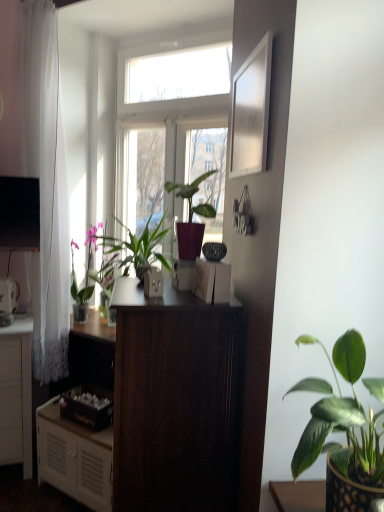
Question: Which direction should I rotate to face green matte plant at center, acting as the second houseplant starting from the right, — up or down?

Choices:
 (A) up
 (B) down

Answer: (A)

Question: Could metallic silver toaster at left, acting as the fifth appliance starting from the right, be considered to be inside wooden crate at lower left, marked as the 2th appliance in a back-to-front arrangement?

Choices:
 (A) no
 (B) yes

Answer: (A)

Question: Can you confirm if wooden crate at lower left, the fourth appliance positioned from the front, is positioned to the right of metallic silver toaster at left, acting as the fifth appliance starting from the right?

Choices:
 (A) yes
 (B) no

Answer: (A)

Question: Is wooden crate at lower left, the fourth appliance positioned from the front, not near metallic silver toaster at left, positioned as the 2th appliance in bottom-to-top order?

Choices:
 (A) yes
 (B) no

Answer: (B)

Question: Does wooden crate at lower left, which appears as the 2th appliance when viewed from the left, have a greater height compared to metallic silver toaster at left, acting as the fifth appliance starting from the right?

Choices:
 (A) yes
 (B) no

Answer: (B)

Question: Are wooden crate at lower left, marked as the fourth appliance in a right-to-left arrangement, and metallic silver toaster at left, which appears as the 4th appliance when viewed from the top, making contact?

Choices:
 (A) no
 (B) yes

Answer: (A)

Question: Is wooden crate at lower left, acting as the 1th appliance starting from the bottom, wider than metallic silver toaster at left, acting as the fifth appliance starting from the right?

Choices:
 (A) yes
 (B) no

Answer: (A)

Question: Does green glossy plant at left, placed as the 3th houseplant when sorted from front to back, come in front of white glossy picture frame at upper right?

Choices:
 (A) yes
 (B) no

Answer: (B)

Question: From the image's perspective, is green glossy plant at left, marked as the 3th houseplant in a right-to-left arrangement, located above white glossy picture frame at upper right?

Choices:
 (A) yes
 (B) no

Answer: (B)

Question: Is green glossy plant at left, placed as the 3th houseplant when sorted from front to back, outside white glossy picture frame at upper right?

Choices:
 (A) yes
 (B) no

Answer: (A)

Question: Does green glossy plant at left, placed as the 3th houseplant when sorted from front to back, have a smaller size compared to white glossy picture frame at upper right?

Choices:
 (A) no
 (B) yes

Answer: (A)

Question: From the image's perspective, would you say green glossy plant at left, placed as the 3th houseplant when sorted from front to back, is shown under white glossy picture frame at upper right?

Choices:
 (A) yes
 (B) no

Answer: (A)

Question: Is green glossy plant at left, marked as the 3th houseplant in a right-to-left arrangement, at the left side of white glossy picture frame at upper right?

Choices:
 (A) yes
 (B) no

Answer: (A)

Question: From a real-world perspective, is dark wood desk at center located higher than matte white outlet at center, which is the fourth appliance in bottom-to-top order?

Choices:
 (A) yes
 (B) no

Answer: (B)